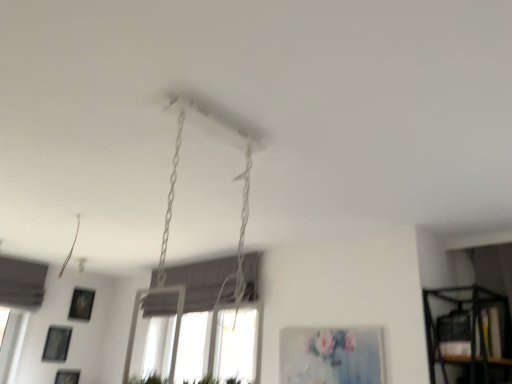
Question: Would you say matte black picture frame at lower left, arranged as the 4th picture frame when viewed from the right, is part of matte black picture frame at lower left, which is the 3th picture frame from left to right,'s contents?

Choices:
 (A) no
 (B) yes

Answer: (A)

Question: Is matte black picture frame at lower left, the second picture frame when ordered from right to left, to the right of matte black picture frame at lower left, which ranks as the second picture frame in bottom-to-top order, from the viewer's perspective?

Choices:
 (A) no
 (B) yes

Answer: (B)

Question: Does matte black picture frame at lower left, which is the 3th picture frame from left to right, touch matte black picture frame at lower left, which ranks as the second picture frame in bottom-to-top order?

Choices:
 (A) no
 (B) yes

Answer: (A)

Question: From a real-world perspective, is matte black picture frame at lower left, the 1th picture frame viewed from the back, over matte black picture frame at lower left, which ranks as the second picture frame in bottom-to-top order?

Choices:
 (A) no
 (B) yes

Answer: (B)

Question: Is matte black picture frame at lower left, marked as the fourth picture frame in a front-to-back arrangement, facing towards matte black picture frame at lower left, the third picture frame viewed from the top?

Choices:
 (A) no
 (B) yes

Answer: (A)

Question: From a real-world perspective, is matte black picture frame at lower left, which is counted as the fourth picture frame, starting from the top, physically located above or below matte black picture frame at lower left, the second picture frame when ordered from right to left?

Choices:
 (A) below
 (B) above

Answer: (A)

Question: Is matte black picture frame at lower left, the third picture frame from the back, bigger or smaller than matte black picture frame at lower left, the second picture frame when ordered from right to left?

Choices:
 (A) small
 (B) big

Answer: (A)

Question: Is matte black picture frame at lower left, which appears as the 3th picture frame when viewed from the right, inside or outside of matte black picture frame at lower left, the 1th picture frame viewed from the back?

Choices:
 (A) inside
 (B) outside

Answer: (B)

Question: Does point (62, 375) appear closer or farther from the camera than point (71, 314)?

Choices:
 (A) closer
 (B) farther

Answer: (A)

Question: From a real-world perspective, is matte black picture frame at lower left, acting as the third picture frame starting from the bottom, above or below matte black picture frame at lower left, which appears as the second picture frame when viewed from the back?

Choices:
 (A) below
 (B) above

Answer: (B)

Question: In the image, is matte black picture frame at lower left, the 1th picture frame viewed from the back, on the left side or the right side of matte black picture frame at lower left, which ranks as the first picture frame in left-to-right order?

Choices:
 (A) left
 (B) right

Answer: (B)

Question: From the image's perspective, is matte black picture frame at lower left, the 1th picture frame viewed from the back, located above or below matte black picture frame at lower left, the third picture frame viewed from the top?

Choices:
 (A) above
 (B) below

Answer: (A)

Question: Considering the positions of point (86, 294) and point (61, 350), is point (86, 294) closer or farther from the camera than point (61, 350)?

Choices:
 (A) closer
 (B) farther

Answer: (B)

Question: Is matte blue canvas at center, which appears as the 1th picture frame when viewed from the right, to the left or to the right of matte black picture frame at lower left, the third picture frame viewed from the top, in the image?

Choices:
 (A) left
 (B) right

Answer: (B)

Question: Is matte blue canvas at center, which appears as the 1th picture frame when viewed from the right, spatially inside matte black picture frame at lower left, arranged as the 4th picture frame when viewed from the right, or outside of it?

Choices:
 (A) inside
 (B) outside

Answer: (B)